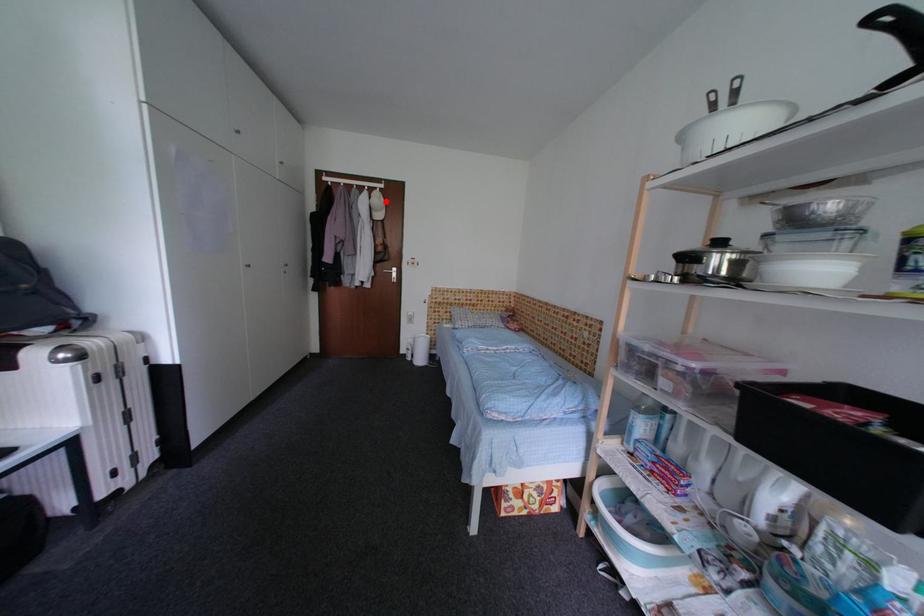
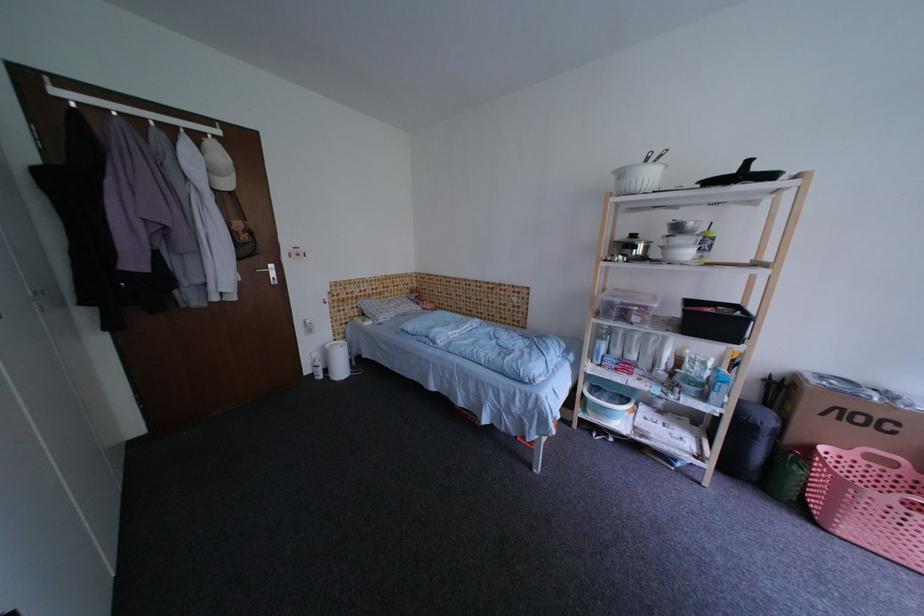
Locate, in the second image, the point that corresponds to the highlighted location in the first image.

(227, 158)